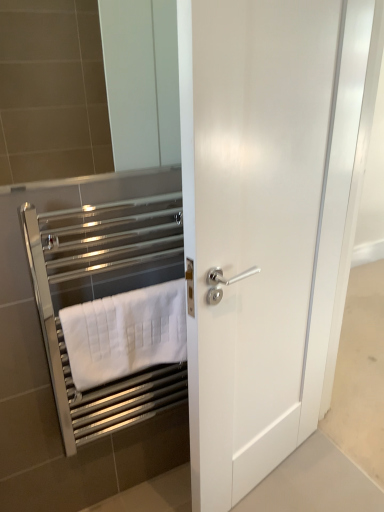
Question: Is chrome metallic towel rack at left thinner than white matte towel at left?

Choices:
 (A) yes
 (B) no

Answer: (B)

Question: From the image's perspective, is chrome metallic towel rack at left below white matte towel at left?

Choices:
 (A) yes
 (B) no

Answer: (B)

Question: Does chrome metallic towel rack at left have a larger size compared to white matte towel at left?

Choices:
 (A) yes
 (B) no

Answer: (A)

Question: From a real-world perspective, does chrome metallic towel rack at left sit lower than white matte towel at left?

Choices:
 (A) yes
 (B) no

Answer: (B)

Question: Is chrome metallic towel rack at left facing away from white matte towel at left?

Choices:
 (A) no
 (B) yes

Answer: (B)

Question: Is chrome metallic towel rack at left taller than white matte towel at left?

Choices:
 (A) no
 (B) yes

Answer: (B)

Question: Is white glossy door at center shorter than white matte towel at left?

Choices:
 (A) no
 (B) yes

Answer: (A)

Question: Considering the relative sizes of white glossy door at center and white matte towel at left in the image provided, is white glossy door at center bigger than white matte towel at left?

Choices:
 (A) yes
 (B) no

Answer: (A)

Question: Can you confirm if white glossy door at center is smaller than white matte towel at left?

Choices:
 (A) no
 (B) yes

Answer: (A)

Question: Considering the relative sizes of white glossy door at center and white matte towel at left in the image provided, is white glossy door at center wider than white matte towel at left?

Choices:
 (A) no
 (B) yes

Answer: (B)

Question: Is white glossy door at center positioned far away from white matte towel at left?

Choices:
 (A) yes
 (B) no

Answer: (B)

Question: Is white glossy door at center positioned before white matte towel at left?

Choices:
 (A) no
 (B) yes

Answer: (B)

Question: Is white glossy door at center at the back of white matte towel at left?

Choices:
 (A) no
 (B) yes

Answer: (A)